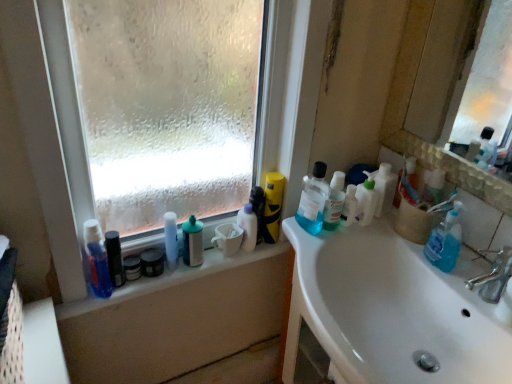
This screenshot has width=512, height=384. In order to click on free space above clear plastic window sill at upper left (from a real-world perspective) in this screenshot , I will do `click(169, 265)`.